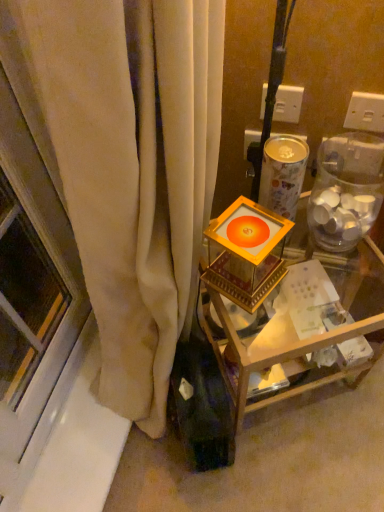
Question: Can you confirm if gold metallic frame at center is wider than white plastic electric outlet at upper center, placed as the 1th electric outlet when sorted from right to left?

Choices:
 (A) no
 (B) yes

Answer: (B)

Question: Is gold metallic frame at center with white plastic electric outlet at upper center, placed as the 1th electric outlet when sorted from right to left?

Choices:
 (A) no
 (B) yes

Answer: (A)

Question: Is the position of gold metallic frame at center less distant than that of white plastic electric outlet at upper center, placed as the 1th electric outlet when sorted from right to left?

Choices:
 (A) no
 (B) yes

Answer: (B)

Question: From a real-world perspective, does gold metallic frame at center sit lower than white plastic electric outlet at upper center, arranged as the second electric outlet when viewed from the left?

Choices:
 (A) yes
 (B) no

Answer: (A)

Question: From the image's perspective, is gold metallic frame at center over white plastic electric outlet at upper center, placed as the 1th electric outlet when sorted from right to left?

Choices:
 (A) no
 (B) yes

Answer: (A)

Question: From the image's perspective, is gold metallic frame at center below white plastic electric outlet at upper center, placed as the 1th electric outlet when sorted from right to left?

Choices:
 (A) no
 (B) yes

Answer: (B)

Question: From a real-world perspective, is white plastic electric outlet at upper right, placed as the 2th electric outlet when sorted from right to left, under gold metallic candle holder at center?

Choices:
 (A) yes
 (B) no

Answer: (B)

Question: Does white plastic electric outlet at upper right, placed as the 2th electric outlet when sorted from right to left, have a greater height compared to gold metallic candle holder at center?

Choices:
 (A) no
 (B) yes

Answer: (A)

Question: Is white plastic electric outlet at upper right, the 1th electric outlet in the left-to-right sequence, placed right next to gold metallic candle holder at center?

Choices:
 (A) no
 (B) yes

Answer: (A)

Question: Would you say white plastic electric outlet at upper right, the 1th electric outlet in the left-to-right sequence, is outside gold metallic candle holder at center?

Choices:
 (A) no
 (B) yes

Answer: (B)

Question: Is white plastic electric outlet at upper right, placed as the 2th electric outlet when sorted from right to left, facing away from gold metallic candle holder at center?

Choices:
 (A) yes
 (B) no

Answer: (B)

Question: Is white plastic electric outlet at upper right, the 1th electric outlet in the left-to-right sequence, further to the viewer compared to gold metallic candle holder at center?

Choices:
 (A) yes
 (B) no

Answer: (A)

Question: From the image's perspective, does transparent plastic jar at right appear lower than white plastic electric outlet at upper center, arranged as the second electric outlet when viewed from the left?

Choices:
 (A) yes
 (B) no

Answer: (A)